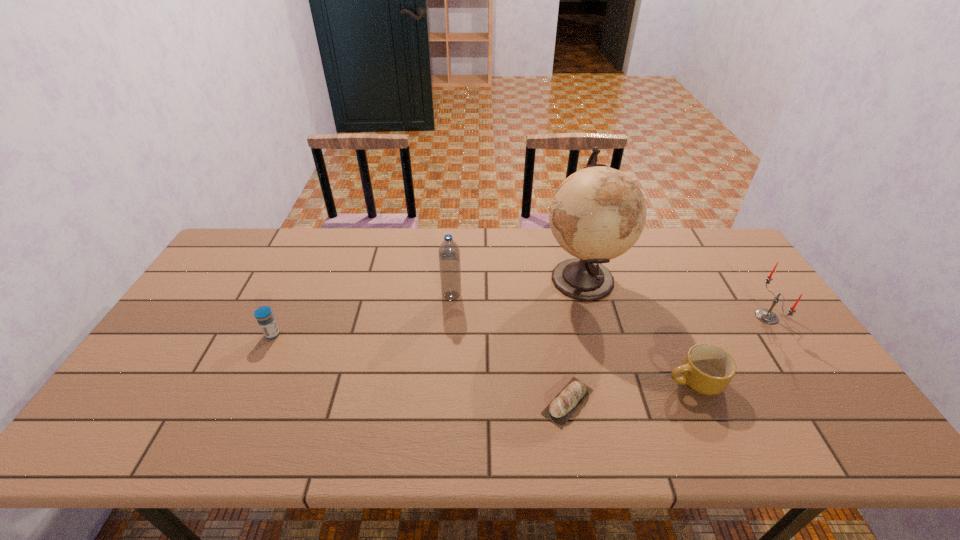
Locate an element on the screen. This screenshot has width=960, height=540. object that is at the far edge is located at coordinates (598, 213).

Identify the location of object present at the near edge. (564, 405).

This screenshot has width=960, height=540. What are the coordinates of `object that is at the right edge` in the screenshot? It's located at (767, 316).

This screenshot has height=540, width=960. I want to click on vacant space at the far edge of the desktop, so click(458, 244).

Where is `vacant space at the left edge of the desktop`? This screenshot has height=540, width=960. vacant space at the left edge of the desktop is located at coordinates (186, 394).

Identify the location of free location at the right edge of the desktop. (777, 400).

In the image, there is a desktop. At what (x,y) coordinates should I click in order to perform the action: click on free region at the far left corner. Please return your answer as a coordinate pair (x, y). Image resolution: width=960 pixels, height=540 pixels. Looking at the image, I should click on (234, 259).

This screenshot has width=960, height=540. What are the coordinates of `vacant area that lies between the tallest object and the leftmost object` in the screenshot? It's located at (427, 306).

This screenshot has width=960, height=540. Identify the location of free space between the leftmost object and the candle. (519, 326).

Locate an element on the screen. This screenshot has width=960, height=540. vacant region between the mug and the fourth shortest object is located at coordinates (731, 349).